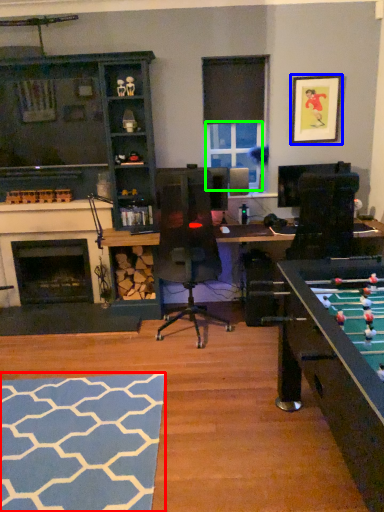
Question: Which is nearer to the flat (highlighted by a red box)? picture frame (highlighted by a blue box) or window screen (highlighted by a green box).

Choices:
 (A) picture frame
 (B) window screen

Answer: (B)